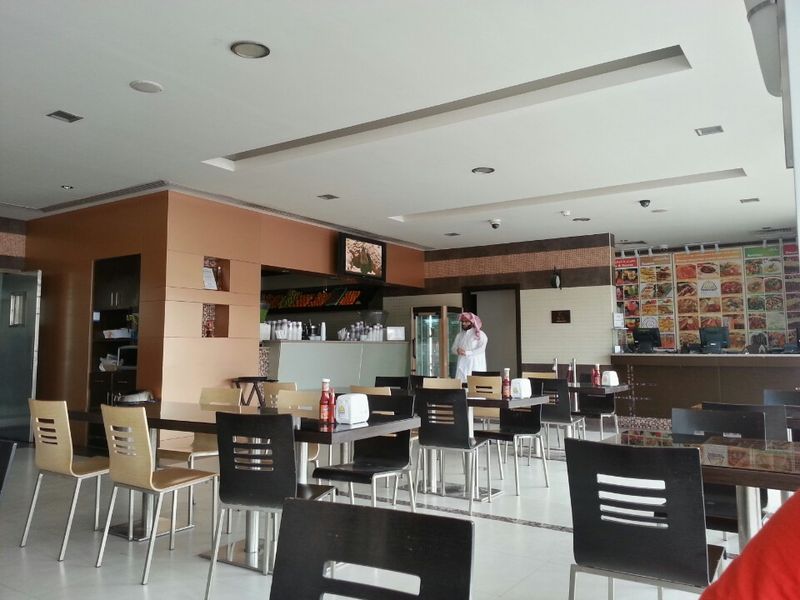
Identify the location of black chairs. (448, 418), (388, 455), (260, 482), (385, 543), (638, 534), (732, 419), (562, 409).